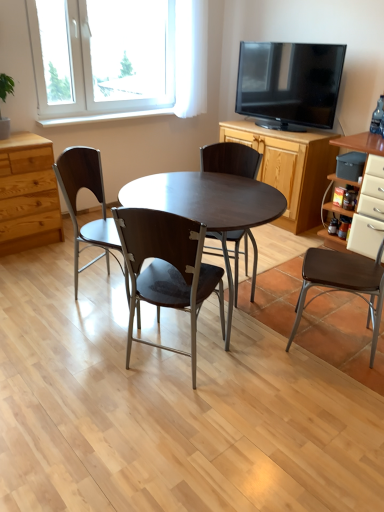
The height and width of the screenshot is (512, 384). In order to click on free space in front of matte brown chair at center, which is counted as the third chair, starting from the right in this screenshot , I will do `click(173, 419)`.